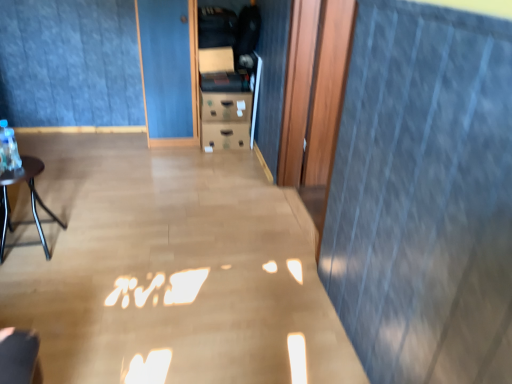
Question: Is point (48, 213) positioned closer to the camera than point (83, 79)?

Choices:
 (A) farther
 (B) closer

Answer: (B)

Question: Considering the relative positions of matte black table at left and blue fabric curtain at upper center in the image provided, is matte black table at left to the left or to the right of blue fabric curtain at upper center?

Choices:
 (A) right
 (B) left

Answer: (B)

Question: Relative to blue fabric curtain at upper center, is matte black table at left in front or behind?

Choices:
 (A) front
 (B) behind

Answer: (A)

Question: Do you think blue fabric curtain at upper center is within matte black table at left, or outside of it?

Choices:
 (A) inside
 (B) outside

Answer: (B)

Question: In the image, is blue fabric curtain at upper center on the left side or the right side of matte black table at left?

Choices:
 (A) left
 (B) right

Answer: (B)

Question: Considering the positions of point (129, 39) and point (23, 162), is point (129, 39) closer or farther from the camera than point (23, 162)?

Choices:
 (A) farther
 (B) closer

Answer: (A)

Question: From the image's perspective, is blue fabric curtain at upper center located above or below matte black table at left?

Choices:
 (A) above
 (B) below

Answer: (A)